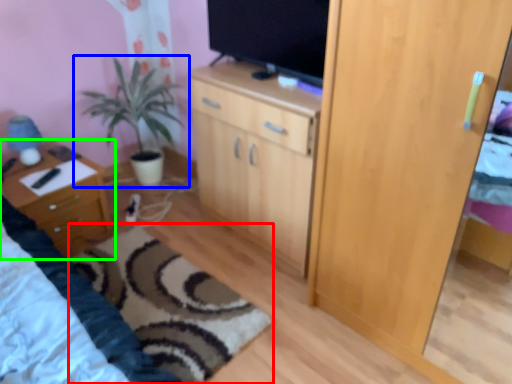
Question: Which object is positioned farthest from plain (highlighted by a red box)? Select from houseplant (highlighted by a blue box) and nightstand (highlighted by a green box).

Choices:
 (A) houseplant
 (B) nightstand

Answer: (A)